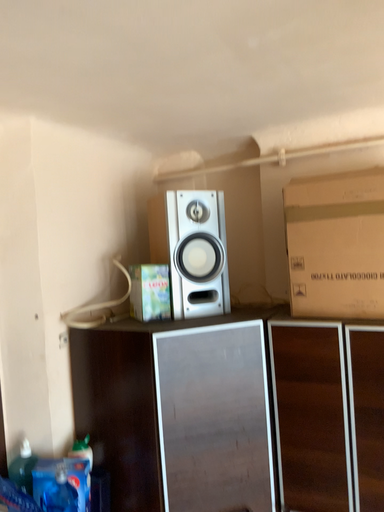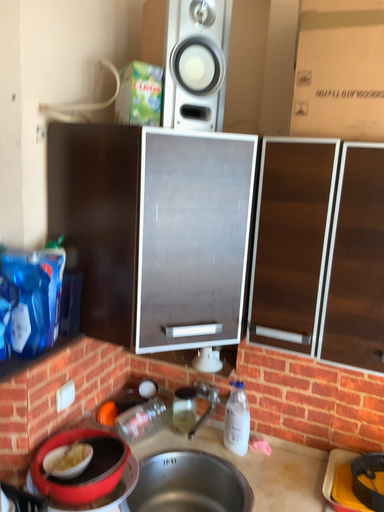
Question: How did the camera likely rotate when shooting the video?

Choices:
 (A) rotated downward
 (B) rotated upward

Answer: (A)